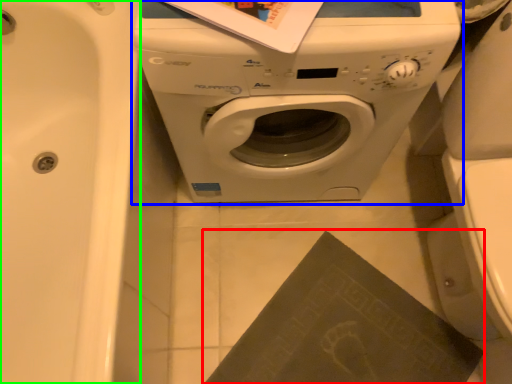
Question: Which object is positioned farthest from paperback book (highlighted by a red box)? Select from washing machine (highlighted by a blue box) and bath (highlighted by a green box).

Choices:
 (A) washing machine
 (B) bath

Answer: (B)